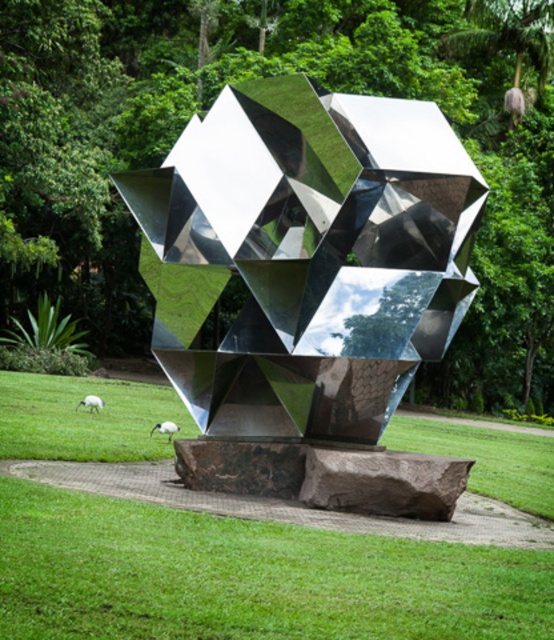
You are standing at the origin point in the park and want to walk to the sculpture. Which direction should you head to reach the sculpture first, considering the green grass at center is in your way?

The green grass at center is located at point (247, 577), so you should head towards the sculpture by moving away from the green grass at center since it is blocking your path.

You are a photographer standing in the park and want to capture the white fluffy sheep at lower left and the green grass at center in your photo. Which object should you focus on first if you want the sheep to appear larger in the frame?

The white fluffy sheep at lower left should be focused on first because it is closer to the camera than the green grass at center, making it appear larger in the frame.

Consider the image. You are standing in the park and want to take a photo of the polished metallic sculpture at center. If your camera has a maximum zoom range of 10 meters, will you be able to capture the sculpture clearly without moving closer?

The distance between you and the polished metallic sculpture at center is 8.82 meters, which is within the camera maximum zoom range of 10 meters. Therefore, you can capture the sculpture clearly without moving closer.